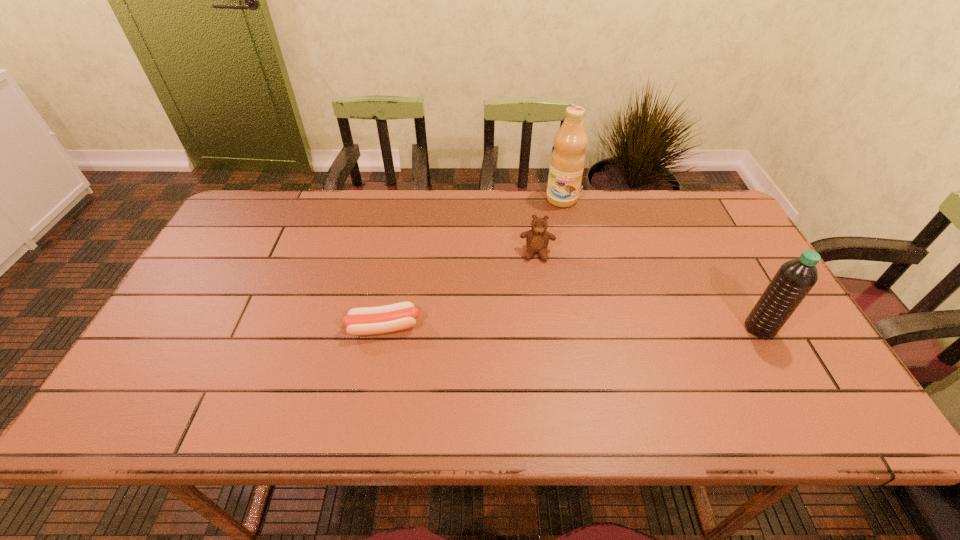
This screenshot has width=960, height=540. What are the coordinates of `free spot on the desktop that is between the leftmost object and the water bottle and is positioned at the face of the second object from left to right` in the screenshot? It's located at (534, 328).

Find the location of a particular element. vacant space on the desktop that is between the sausage and the water bottle and is positioned on the label of the farthest object is located at coordinates (531, 328).